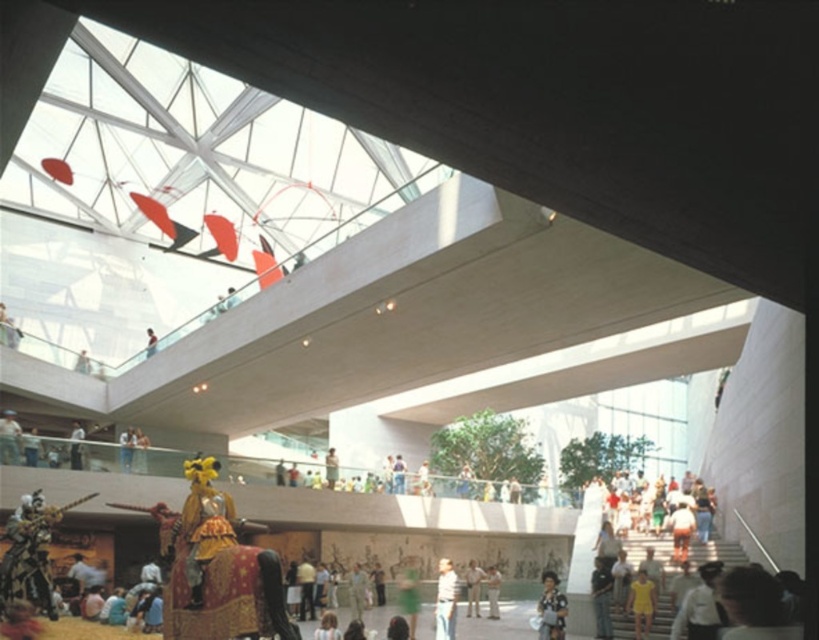
Question: Which object is closer to the camera taking this photo?

Choices:
 (A) patterned fabric dress at lower center
 (B) green fabric dress at center
 (C) light brown leather jacket at center
 (D) light blue jeans at center

Answer: (A)

Question: Which object appears closest to the camera in this image?

Choices:
 (A) light brown leather jacket at upper center
 (B) green fabric dress at center
 (C) white shirt at lower right
 (D) light brown leather jacket at center

Answer: (C)

Question: Which object is the farthest from the light brown leather jacket at center?

Choices:
 (A) patterned fabric dress at lower center
 (B) light brown leather jacket at lower left
 (C) light brown leather jacket at upper center
 (D) yellow matte dress at lower right

Answer: (B)

Question: Does light blue jeans at center appear over yellow matte dress at lower right?

Choices:
 (A) no
 (B) yes

Answer: (A)

Question: Does light brown leather jacket at center have a smaller size compared to light brown leather jacket at upper center?

Choices:
 (A) no
 (B) yes

Answer: (A)

Question: Does white shirt at lower right have a lesser width compared to light brown leather jacket at lower right?

Choices:
 (A) no
 (B) yes

Answer: (A)